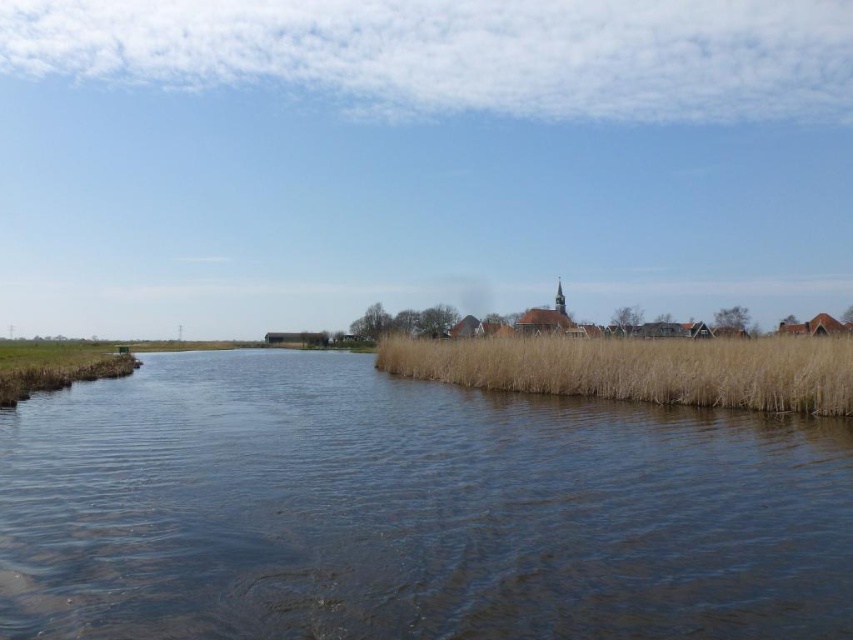
Can you confirm if dry grass at center is bigger than brown grassy reed at lower left?

Yes, dry grass at center is bigger than brown grassy reed at lower left.

Based on the photo, between dry grass at center and brown grassy reed at lower left, which one appears on the left side from the viewer's perspective?

From the viewer's perspective, brown grassy reed at lower left appears more on the left side.

Who is more distant from viewer, (x=715, y=353) or (x=30, y=372)?

Positioned behind is point (x=30, y=372).

Where is `dry grass at center`? Image resolution: width=853 pixels, height=640 pixels. dry grass at center is located at coordinates (642, 369).

Is brown grassy river at center wider than dry grass at center?

Yes, brown grassy river at center is wider than dry grass at center.

Is point (814, 550) more distant than point (761, 380)?

No.

Who is more distant from viewer, (526, 550) or (575, 337)?

Point (575, 337)

At what (x,y) coordinates should I click in order to perform the action: click on brown grassy river at center. Please return your answer as a coordinate pair (x, y). The height and width of the screenshot is (640, 853). Looking at the image, I should click on (409, 512).

Can you confirm if brown grassy river at center is smaller than brown grassy reed at lower left?

Correct, brown grassy river at center occupies less space than brown grassy reed at lower left.

Is brown grassy river at center bigger than brown grassy reed at lower left?

Actually, brown grassy river at center might be smaller than brown grassy reed at lower left.

You are a GUI agent. You are given a task and a screenshot of the screen. Output one action in this format:
    pyautogui.click(x=<x>, y=<y>)
    Task: Click on the brown grassy river at center
    Image resolution: width=853 pixels, height=640 pixels.
    Given the screenshot: What is the action you would take?
    [409, 512]